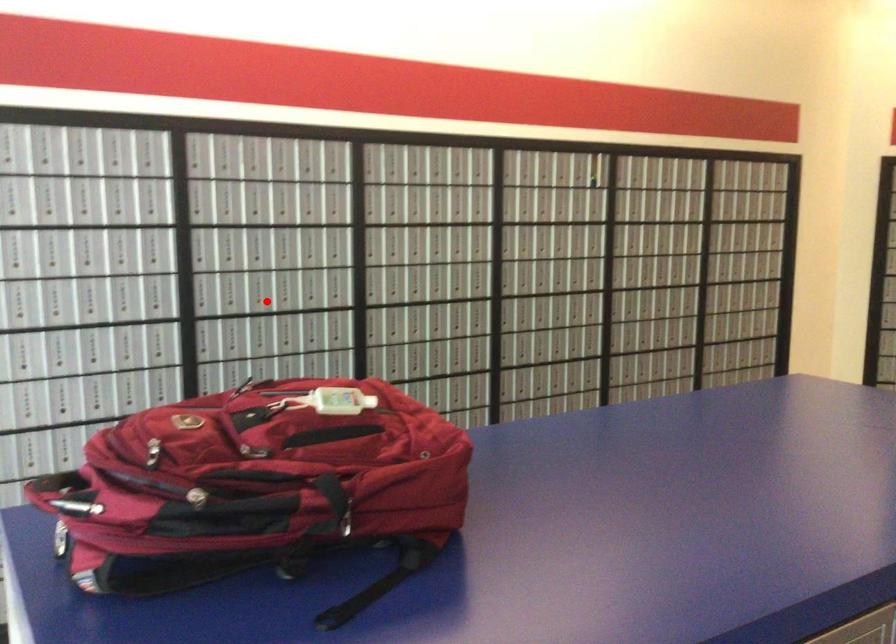
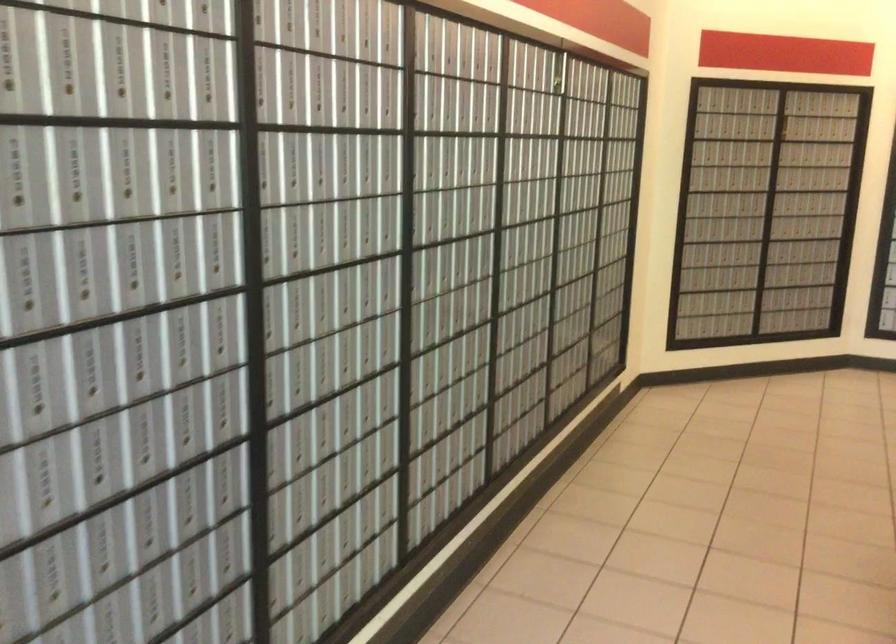
Locate, in the second image, the point that corresponds to the highlighted location in the first image.

(329, 252)